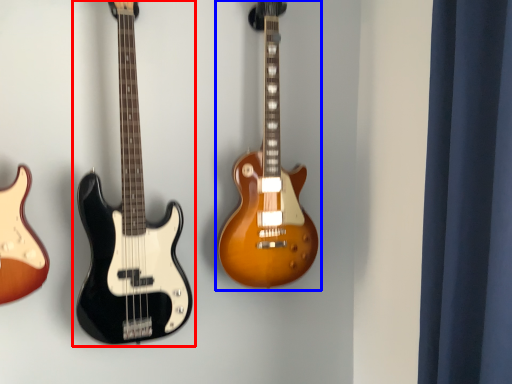
Question: Which object is further to the camera taking this photo, guitar (highlighted by a red box) or guitar (highlighted by a blue box)?

Choices:
 (A) guitar
 (B) guitar

Answer: (B)